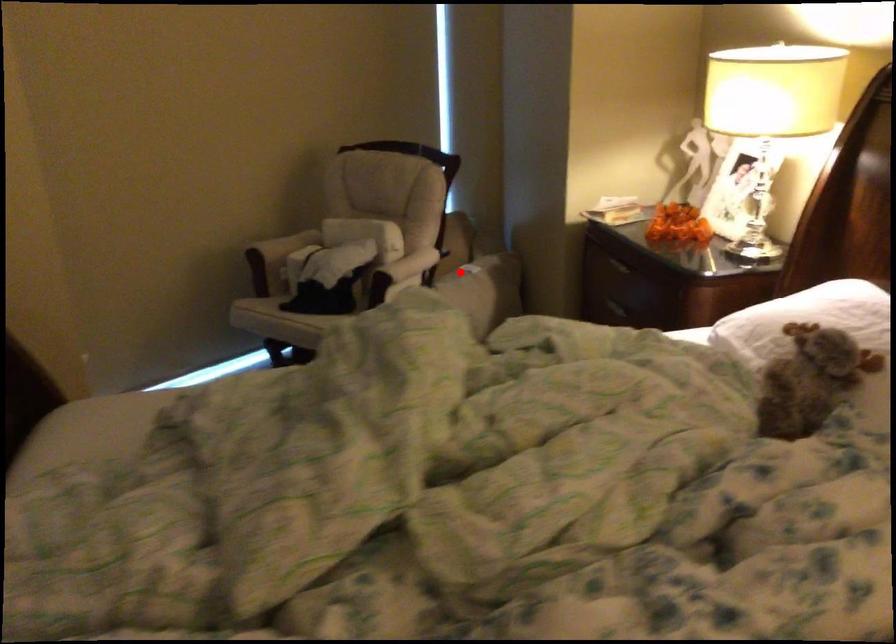
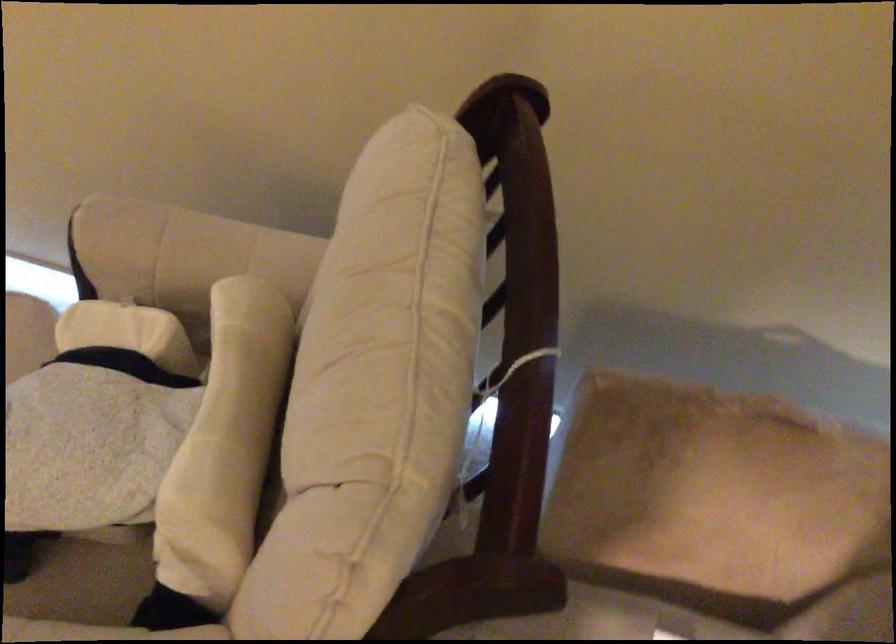
Locate, in the second image, the point that corresponds to the highlighted location in the first image.

(604, 621)